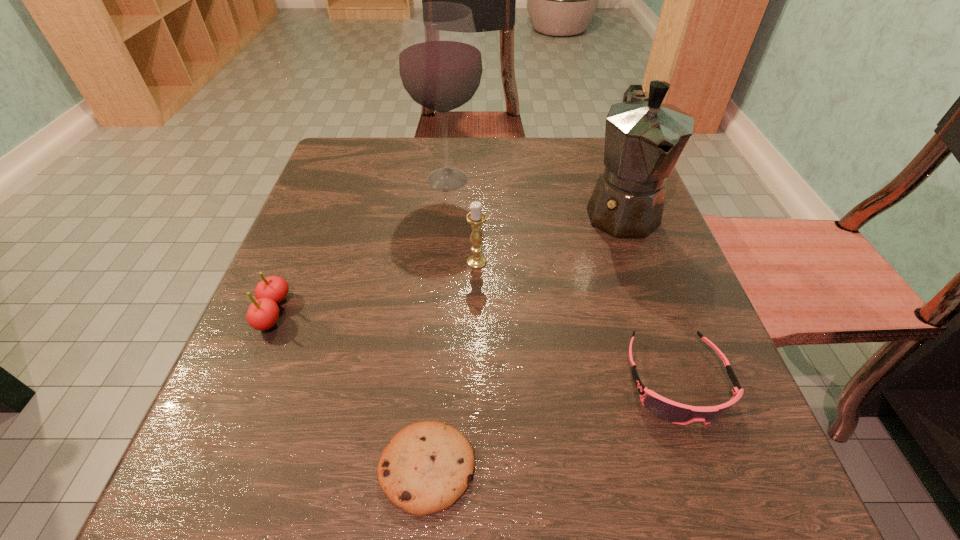
Where is `vacant space situated 0.220m on the back of the third farthest object`? The height and width of the screenshot is (540, 960). vacant space situated 0.220m on the back of the third farthest object is located at coordinates (477, 188).

What are the coordinates of `vacant space located on the right of the leftmost object` in the screenshot? It's located at tap(480, 313).

You are a GUI agent. You are given a task and a screenshot of the screen. Output one action in this format:
    pyautogui.click(x=<x>, y=<y>)
    Task: Click on the blank space located 0.050m on the front-facing side of the fifth tallest object
    
    Given the screenshot: What is the action you would take?
    pyautogui.click(x=707, y=468)

I want to click on free space located on the back of the cookie, so click(x=442, y=298).

Locate an element on the screen. alcohol that is at the far edge is located at coordinates (440, 63).

Find the location of a particular element. coffeepot positioned at the far edge is located at coordinates (644, 138).

In order to click on object present at the near edge in this screenshot , I will do `click(428, 465)`.

Image resolution: width=960 pixels, height=540 pixels. What are the coordinates of `object present at the left edge` in the screenshot? It's located at (263, 313).

Find the location of a particular element. This screenshot has height=540, width=960. coffeepot that is at the right edge is located at coordinates (644, 138).

Where is `goggles situated at the right edge`? This screenshot has height=540, width=960. goggles situated at the right edge is located at coordinates (671, 411).